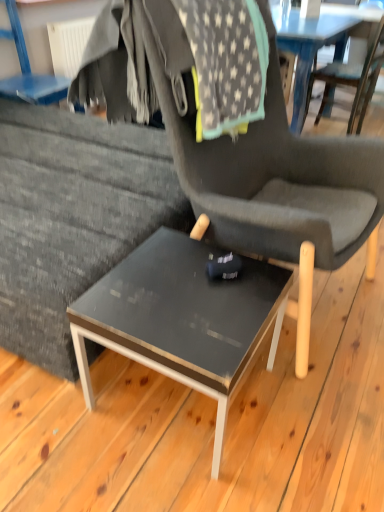
At what (x,y) coordinates should I click in order to perform the action: click on vacant space situated above matte black table at center (from a real-world perspective). Please return your answer as a coordinate pair (x, y). Looking at the image, I should click on [x=187, y=287].